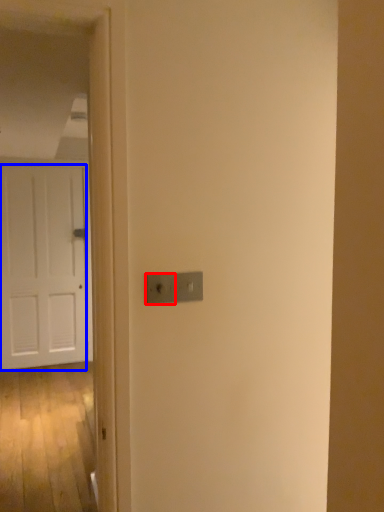
Question: Which object is closer to the camera taking this photo, light switch (highlighted by a red box) or door (highlighted by a blue box)?

Choices:
 (A) light switch
 (B) door

Answer: (A)